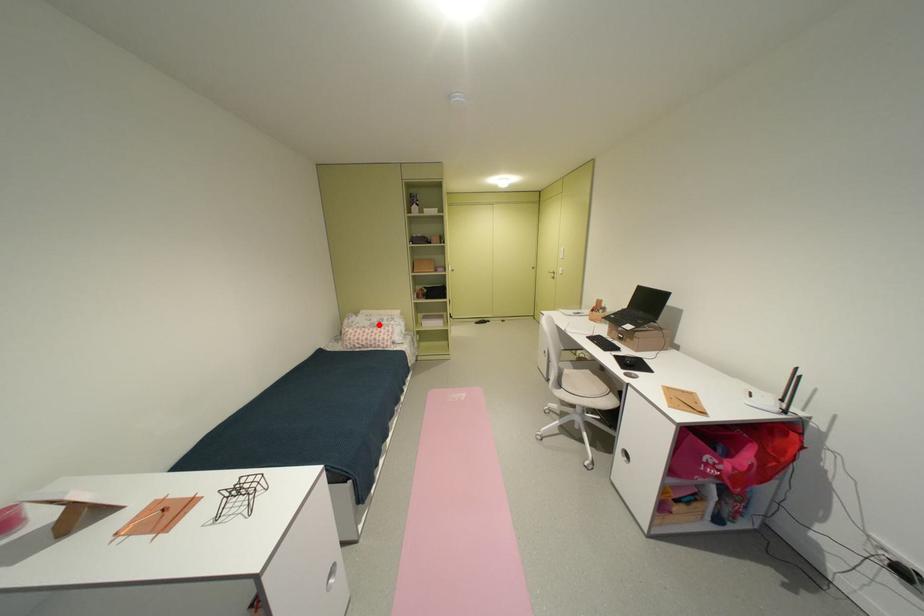
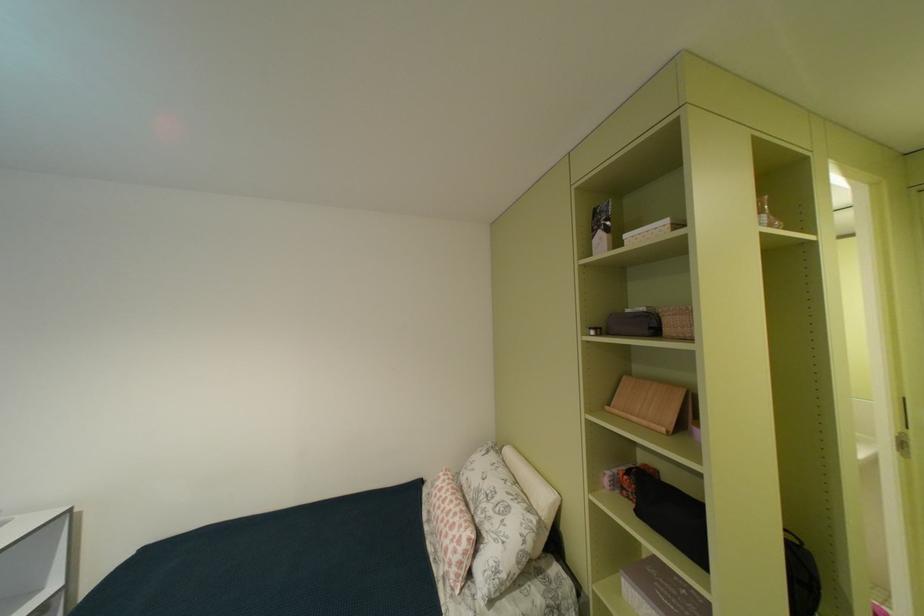
The point at the highlighted location is marked in the first image. Where is the corresponding point in the second image?

(487, 487)